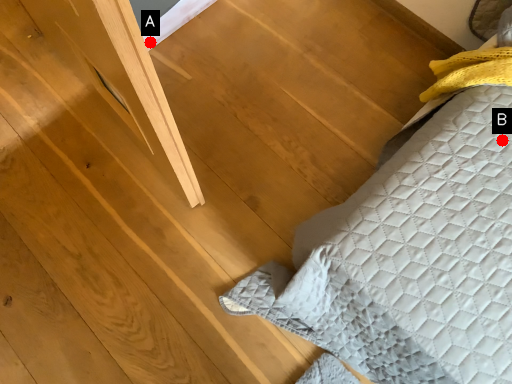
Question: Two points are circled on the image, labeled by A and B beside each circle. Among these points, which one is farthest from the camera?

Choices:
 (A) A is further
 (B) B is further

Answer: (A)